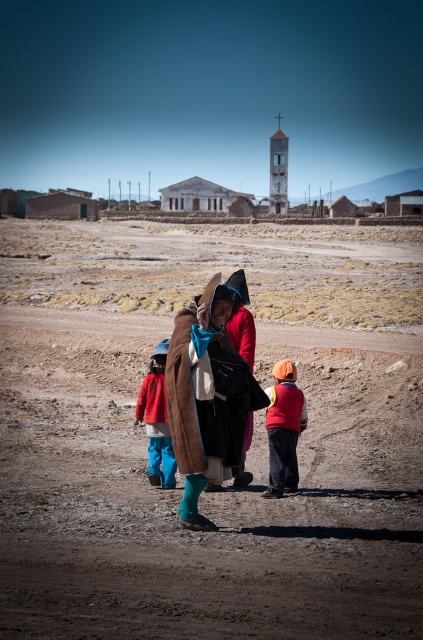
Is dull brown dirt field at center smaller than orange knit hat at center?

Incorrect, dull brown dirt field at center is not smaller in size than orange knit hat at center.

Who is positioned more to the left, dull brown dirt field at center or orange knit hat at center?

From the viewer's perspective, dull brown dirt field at center appears more on the left side.

Is point (271, 509) farther from camera compared to point (271, 468)?

No, it is in front of (271, 468).

Image resolution: width=423 pixels, height=640 pixels. I want to click on dull brown dirt field at center, so click(x=247, y=452).

The width and height of the screenshot is (423, 640). What do you see at coordinates (247, 452) in the screenshot? I see `dull brown dirt field at center` at bounding box center [247, 452].

Does dull brown dirt field at center come behind brown woolen coat at center?

No.

Is point (33, 474) closer to viewer compared to point (235, 355)?

No, (33, 474) is further to viewer.

Where is `dull brown dirt field at center`? dull brown dirt field at center is located at coordinates (247, 452).

Can you confirm if brown woolen coat at center is thinner than matte red jacket at center?

In fact, brown woolen coat at center might be wider than matte red jacket at center.

Can you confirm if brown woolen coat at center is positioned to the left of matte red jacket at center?

No, brown woolen coat at center is not to the left of matte red jacket at center.

Where is `brown woolen coat at center`? The height and width of the screenshot is (640, 423). brown woolen coat at center is located at coordinates (206, 397).